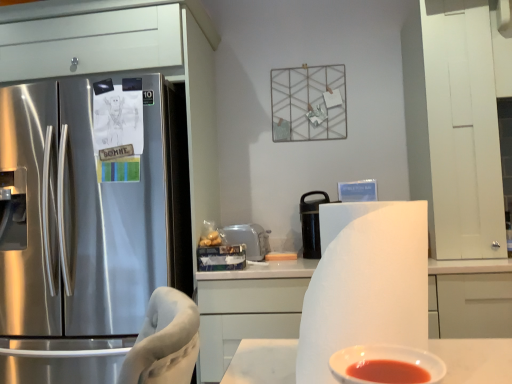
What do you see at coordinates (365, 283) in the screenshot? This screenshot has width=512, height=384. I see `white matte paper towel at center` at bounding box center [365, 283].

Identify the location of white matte paper towel at center. (365, 283).

This screenshot has height=384, width=512. What do you see at coordinates (83, 211) in the screenshot?
I see `stainless steel refrigerator at left` at bounding box center [83, 211].

Describe the element at coordinates (311, 224) in the screenshot. I see `black matte thermos at center, which is counted as the 1th appliance, starting from the right` at that location.

What is the approximate width of white matte cabinet at center?

It is 65.33 centimeters.

The height and width of the screenshot is (384, 512). What are the coordinates of `white plastic toaster at center, which ranks as the first appliance in left-to-right order` in the screenshot? It's located at (248, 239).

This screenshot has height=384, width=512. I want to click on white matte paper towel at center, so click(365, 283).

Is black matte thermos at center, which is counted as the 1th appliance, starting from the right, to the right of white matte paper towel at center from the viewer's perspective?

Indeed, black matte thermos at center, which is counted as the 1th appliance, starting from the right, is positioned on the right side of white matte paper towel at center.

From their relative heights in the image, would you say black matte thermos at center, which is counted as the 2th appliance, starting from the left, is taller or shorter than white matte paper towel at center?

In the image, black matte thermos at center, which is counted as the 2th appliance, starting from the left, appears to be taller than white matte paper towel at center.

Where is `paper towel above the black matte thermos at center, which is counted as the 2th appliance, starting from the left (from the image's perspective)`? Image resolution: width=512 pixels, height=384 pixels. paper towel above the black matte thermos at center, which is counted as the 2th appliance, starting from the left (from the image's perspective) is located at coordinates (365, 283).

Considering the relative sizes of black matte thermos at center, which is counted as the 1th appliance, starting from the right, and white matte paper towel at center in the image provided, is black matte thermos at center, which is counted as the 1th appliance, starting from the right, smaller than white matte paper towel at center?

Indeed, black matte thermos at center, which is counted as the 1th appliance, starting from the right, has a smaller size compared to white matte paper towel at center.

Which object is thinner, white matte cabinet at center or white matte paper towel at center?

white matte paper towel at center.

Does white matte cabinet at center have a greater height compared to white matte paper towel at center?

Yes.

Are white matte cabinet at center and white matte paper towel at center located far from each other?

white matte cabinet at center is far away from white matte paper towel at center.

Is white matte cabinet at center oriented towards white matte paper towel at center?

Yes, white matte cabinet at center is facing white matte paper towel at center.

Would you say white matte paper towel at center is a long distance from white matte cabinet at center?

Yes, white matte paper towel at center is far from white matte cabinet at center.

Could you tell me if white matte paper towel at center is facing white matte cabinet at center?

No, white matte paper towel at center is not facing towards white matte cabinet at center.

Is point (356, 268) less distant than point (441, 289)?

Yes, it is in front of point (441, 289).

Is white plastic toaster at center, which ranks as the second appliance in right-to-left order, inside white glossy bowl at lower center?

No, white plastic toaster at center, which ranks as the second appliance in right-to-left order, is located outside of white glossy bowl at lower center.

In the scene shown: From a real-world perspective, is white glossy bowl at lower center on white plastic toaster at center, which ranks as the first appliance in left-to-right order?

Incorrect, from a real-world perspective, white glossy bowl at lower center is lower than white plastic toaster at center, which ranks as the first appliance in left-to-right order.

Can you confirm if white glossy bowl at lower center is thinner than white plastic toaster at center, which ranks as the second appliance in right-to-left order?

Indeed, white glossy bowl at lower center has a lesser width compared to white plastic toaster at center, which ranks as the second appliance in right-to-left order.

Looking at the image, does black matte thermos at center, which is counted as the 1th appliance, starting from the right, seem bigger or smaller compared to white glossy bowl at lower center?

In the image, black matte thermos at center, which is counted as the 1th appliance, starting from the right, appears to be larger than white glossy bowl at lower center.

From their relative heights in the image, would you say black matte thermos at center, which is counted as the 2th appliance, starting from the left, is taller or shorter than white glossy bowl at lower center?

black matte thermos at center, which is counted as the 2th appliance, starting from the left, is taller than white glossy bowl at lower center.

From the image's perspective, is black matte thermos at center, which is counted as the 2th appliance, starting from the left, under white glossy bowl at lower center?

Actually, black matte thermos at center, which is counted as the 2th appliance, starting from the left, appears above white glossy bowl at lower center in the image.

Between black matte thermos at center, which is counted as the 1th appliance, starting from the right, and white matte cabinet at center, which one has more height?

Standing taller between the two is white matte cabinet at center.

Is black matte thermos at center, which is counted as the 2th appliance, starting from the left, oriented away from white matte cabinet at center?

That's not correct — black matte thermos at center, which is counted as the 2th appliance, starting from the left, is not looking away from white matte cabinet at center.

Consider the image. Considering the sizes of objects black matte thermos at center, which is counted as the 1th appliance, starting from the right, and white matte cabinet at center in the image provided, who is bigger, black matte thermos at center, which is counted as the 1th appliance, starting from the right, or white matte cabinet at center?

With larger size is white matte cabinet at center.

From the image's perspective, is black matte thermos at center, which is counted as the 2th appliance, starting from the left, located above or below white matte cabinet at center?

black matte thermos at center, which is counted as the 2th appliance, starting from the left, is above white matte cabinet at center.

From the image's perspective, is white matte paper towel at center above or below white glossy bowl at lower center?

From the image's perspective, white matte paper towel at center appears above white glossy bowl at lower center.

Looking at this image, between white matte paper towel at center and white glossy bowl at lower center, which one has larger width?

white matte paper towel at center is wider.

Is the surface of white matte paper towel at center in direct contact with white glossy bowl at lower center?

No, white matte paper towel at center is not touching white glossy bowl at lower center.

This screenshot has width=512, height=384. In the image, there is a black matte thermos at center, which is counted as the 1th appliance, starting from the right. What are the coordinates of `paper towel below it (from a real-world perspective)` in the screenshot? It's located at (365, 283).

Find the location of a particular element. cabinetry below the white matte paper towel at center (from the image's perspective) is located at coordinates (248, 308).

Looking at the image, which one is located further to stainless steel refrigerator at left, white plastic toaster at center, which ranks as the first appliance in left-to-right order, or white matte cabinet at center?

Based on the image, white plastic toaster at center, which ranks as the first appliance in left-to-right order, appears to be further to stainless steel refrigerator at left.

From the picture: Based on their spatial positions, is white plastic toaster at center, which ranks as the second appliance in right-to-left order, or white glossy bowl at lower center further from white matte paper towel at center?

white plastic toaster at center, which ranks as the second appliance in right-to-left order, is further to white matte paper towel at center.

Based on their spatial positions, is white glossy bowl at lower center or stainless steel refrigerator at left further from white plastic toaster at center, which ranks as the first appliance in left-to-right order?

white glossy bowl at lower center lies further to white plastic toaster at center, which ranks as the first appliance in left-to-right order, than the other object.

When comparing their distances from black matte thermos at center, which is counted as the 1th appliance, starting from the right, does white plastic toaster at center, which ranks as the second appliance in right-to-left order, or white matte cabinet at center seem further?

white matte cabinet at center is further to black matte thermos at center, which is counted as the 1th appliance, starting from the right.

From the image, which object appears to be nearer to white matte cabinet at center, stainless steel refrigerator at left or white matte paper towel at center?

stainless steel refrigerator at left is closer to white matte cabinet at center.

Which object lies nearer to the anchor point white glossy bowl at lower center, black matte thermos at center, which is counted as the 2th appliance, starting from the left, or white matte paper towel at center?

white matte paper towel at center is closer to white glossy bowl at lower center.

Based on the photo, based on their spatial positions, is stainless steel refrigerator at left or white glossy bowl at lower center further from white matte paper towel at center?

Based on the image, stainless steel refrigerator at left appears to be further to white matte paper towel at center.

Looking at this image, which object lies nearer to the anchor point white matte cabinet at center, white plastic toaster at center, which ranks as the first appliance in left-to-right order, or white matte paper towel at center?

Based on the image, white plastic toaster at center, which ranks as the first appliance in left-to-right order, appears to be nearer to white matte cabinet at center.

Locate an element on the screen. The width and height of the screenshot is (512, 384). refrigerator between white glossy bowl at lower center and white plastic toaster at center, which ranks as the first appliance in left-to-right order, along the z-axis is located at coordinates (83, 211).

Locate an element on the screen. The image size is (512, 384). cabinetry between white matte paper towel at center and stainless steel refrigerator at left from front to back is located at coordinates (248, 308).

You are a GUI agent. You are given a task and a screenshot of the screen. Output one action in this format:
    pyautogui.click(x=<x>, y=<y>)
    Task: Click on the refrigerator positioned between white matte paper towel at center and white plastic toaster at center, which ranks as the second appliance in right-to-left order, from near to far
    The image size is (512, 384).
    Given the screenshot: What is the action you would take?
    pyautogui.click(x=83, y=211)

Where is `refrigerator between white matte paper towel at center and black matte thermos at center, which is counted as the 2th appliance, starting from the left, in the front-back direction`? Image resolution: width=512 pixels, height=384 pixels. refrigerator between white matte paper towel at center and black matte thermos at center, which is counted as the 2th appliance, starting from the left, in the front-back direction is located at coordinates (83, 211).